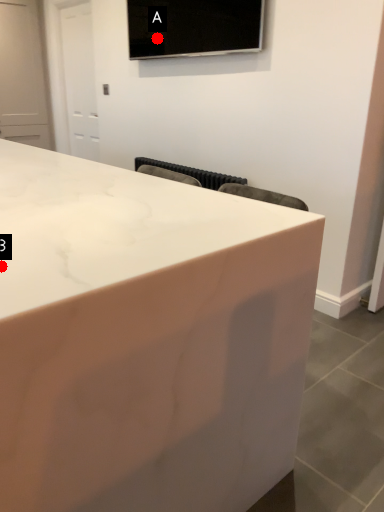
Question: Two points are circled on the image, labeled by A and B beside each circle. Which of the following is the closest to the observer?

Choices:
 (A) A is closer
 (B) B is closer

Answer: (B)